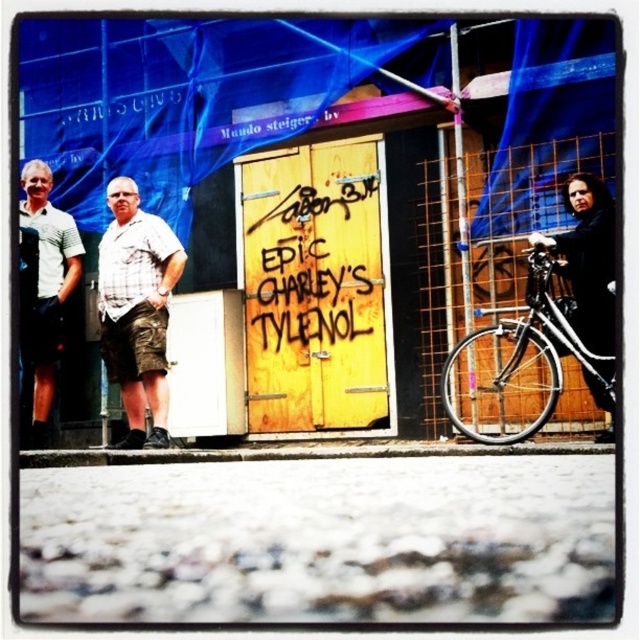
You are a delivery person who needs to park your shiny black bicycle at right near the graffiti doors without blocking the camera. Can you park it there? Explain why or why not based on the distance between them.

The shiny black bicycle at right and the camera are 19.12 feet apart. Since the distance is sufficient, you can park the shiny black bicycle at right near the graffiti doors without blocking the camera.

You are a delivery person who needs to park your shiny black bicycle at right near the black matte coat at right. Since both are on the same side of the street, will the bicycle take up more space than the coat?

The shiny black bicycle at right is bigger than the black matte coat at right, so yes, the bicycle will take up more space than the coat.

You are a delivery person needing to park your shiny black bicycle at right near the yellow wooden doors with graffiti. The doors are at the center. Is the parking spot at point [522,356] close enough to the doors?

The shiny black bicycle at right is located at point [522,356], which is near the yellow wooden doors with graffiti at the center, so yes, the parking spot is close enough.